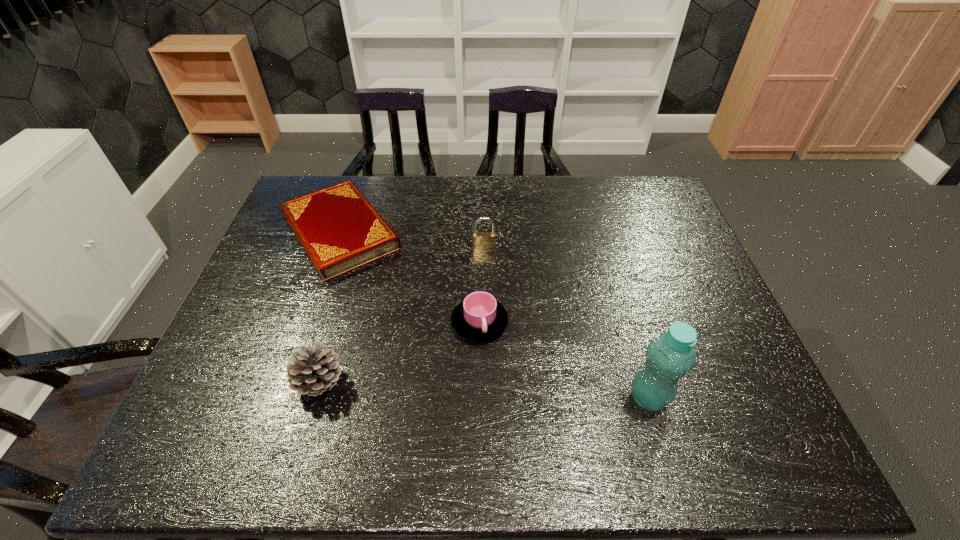
The image size is (960, 540). Identify the location of free space that is in between the pinecone and the third nearest object. (399, 353).

The height and width of the screenshot is (540, 960). Identify the location of unoccupied position between the padlock and the water bottle. (566, 323).

Where is `free spot between the pinecone and the third farthest object`? The width and height of the screenshot is (960, 540). free spot between the pinecone and the third farthest object is located at coordinates (399, 353).

Locate an element on the screen. The image size is (960, 540). free space between the third nearest object and the padlock is located at coordinates (482, 286).

The width and height of the screenshot is (960, 540). Find the location of `free area in between the pinecone and the tallest object`. free area in between the pinecone and the tallest object is located at coordinates (484, 390).

Point out which object is positioned as the second nearest to the rightmost object. Please provide its 2D coordinates. Your answer should be formatted as a tuple, i.e. [(x, y)], where the tuple contains the x and y coordinates of a point satisfying the conditions above.

[(481, 241)]

Select which object appears as the third closest to the second shortest object. Please provide its 2D coordinates. Your answer should be formatted as a tuple, i.e. [(x, y)], where the tuple contains the x and y coordinates of a point satisfying the conditions above.

[(312, 372)]

This screenshot has width=960, height=540. Find the location of `free space that satisfies the following two spatial constraints: 1. on the front side of the padlock; 2. on the left side of the hardback book`. free space that satisfies the following two spatial constraints: 1. on the front side of the padlock; 2. on the left side of the hardback book is located at coordinates (335, 249).